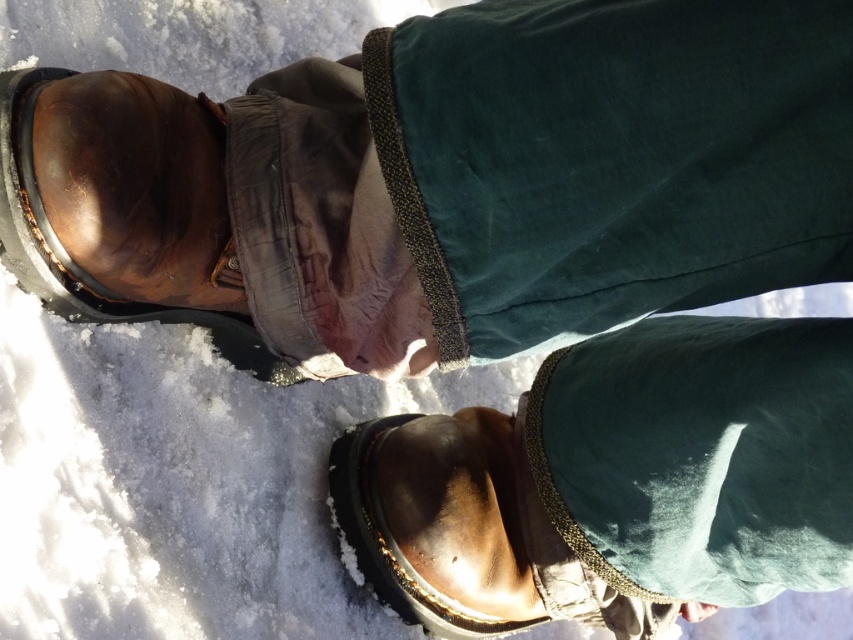
Is brown leather boot at left further to the viewer compared to shiny brown leather boot at lower center?

No, it is in front of shiny brown leather boot at lower center.

Based on the photo, is brown leather boot at left above shiny brown leather boot at lower center?

Indeed, brown leather boot at left is positioned over shiny brown leather boot at lower center.

This screenshot has width=853, height=640. Describe the element at coordinates (76, 264) in the screenshot. I see `brown leather boot at left` at that location.

You are a GUI agent. You are given a task and a screenshot of the screen. Output one action in this format:
    pyautogui.click(x=<x>, y=<y>)
    Task: Click on the brown leather boot at left
    
    Given the screenshot: What is the action you would take?
    pyautogui.click(x=76, y=264)